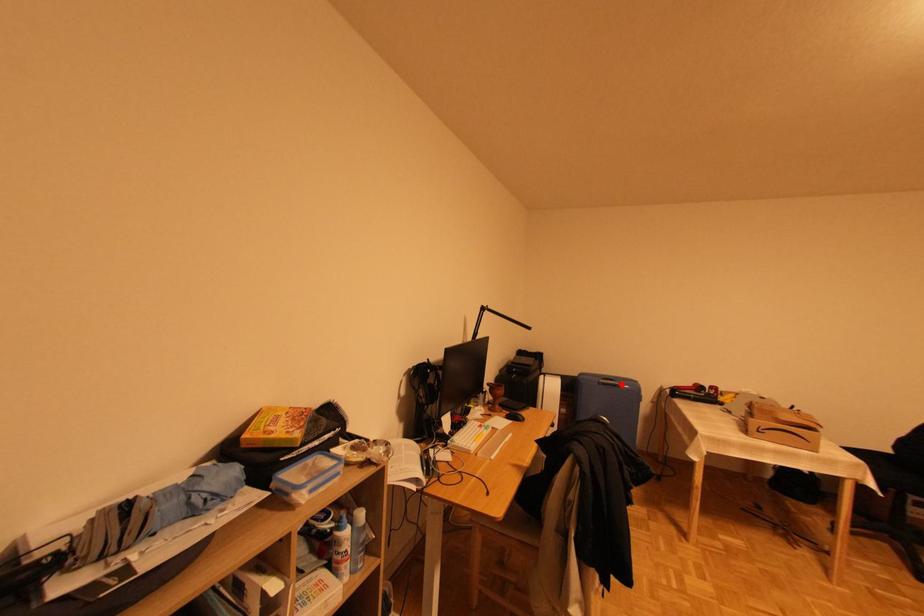
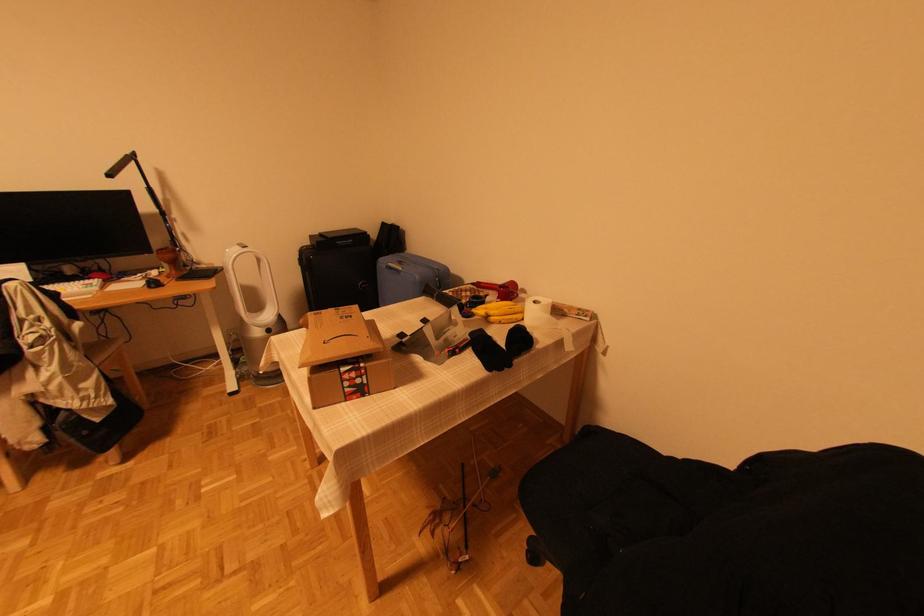
Question: I am providing you with two images of the same scene from different viewpoints. A red point is marked on the first image. Is the red point's position out of view in image 2?

Choices:
 (A) Yes
 (B) No

Answer: (B)